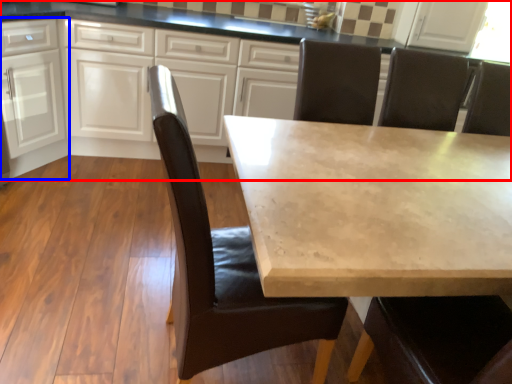
Question: Which object is further to the camera taking this photo, cabinetry (highlighted by a red box) or cabinetry (highlighted by a blue box)?

Choices:
 (A) cabinetry
 (B) cabinetry

Answer: (B)